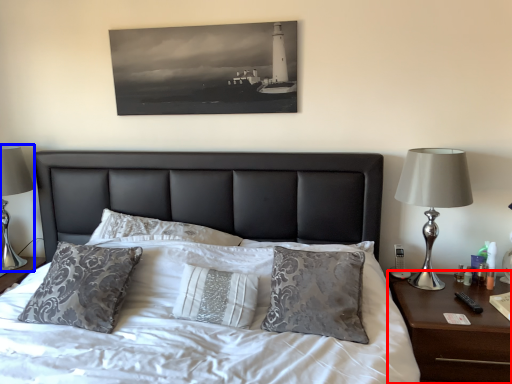
Question: Which of the following is the closest to the observer, nightstand (highlighted by a red box) or table lamp (highlighted by a blue box)?

Choices:
 (A) nightstand
 (B) table lamp

Answer: (A)